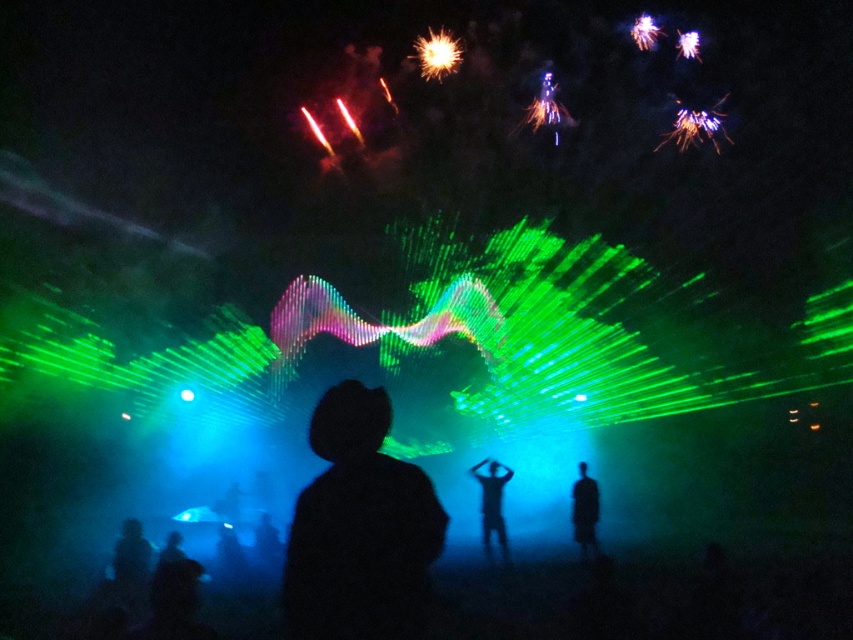
You are standing at the festival and see the black matte person at center. If you want to throw a water balloon to hit them, considering the distance is 13.09 meters, is this distance within the typical range of a water balloon throw?

The black matte person at center is 13.09 meters away from the viewer. The typical range for a water balloon throw is around 10 to 15 meters, so yes, it is within the typical range.

You are at a festival and want to take a photo of the fireworks. You notice two points in the sky marked as point (308, 554) and point (502, 513). Which point is closer to you when you look through your camera lens?

Point (308, 554) is in front of point (502, 513), so it is closer to you when looking through the camera lens.

You are standing at the origin point of the coordinate system in this image. You want to locate the black matte jacket at center. In which direction should you move to reach it?

The black matte jacket at center is located at coordinate point 0.827 on the x axis and 0.422 on the y axis. Since you are at the origin, you should move towards the right along the x axis and slightly upwards along the y axis to reach the black matte jacket at center.